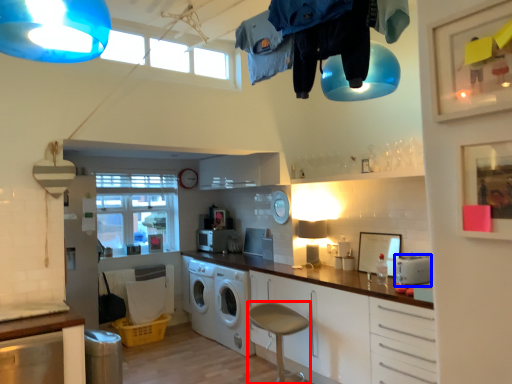
Question: Which object appears closest to the camera in this image, bar stool (highlighted by a red box) or appliance (highlighted by a blue box)?

Choices:
 (A) bar stool
 (B) appliance

Answer: (A)